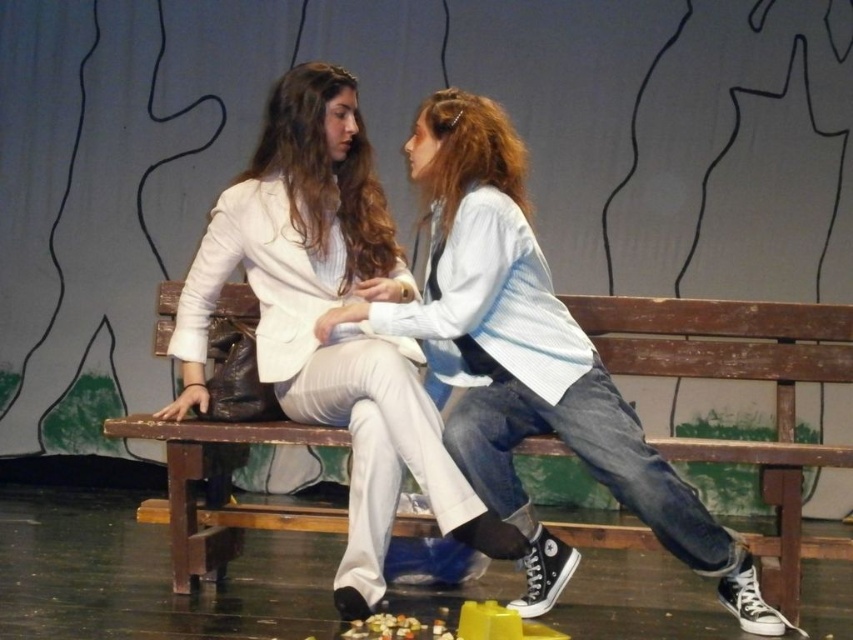
You are designing a stage set and need to ensure that the white matte blazer at center and the wooden bench at center fit within a 2 meter wide stage. Based on the description, can both objects fit side by side on the stage?

The white matte blazer at center might be wider than the wooden bench at center, so it is uncertain if both can fit side by side within the 2 meter width without overlapping. Further measurements are needed.

You are designing a theater set and need to ensure that the matte white blouse at center is visible over the wooden bench at center. Based on the scene description, will the blouse be visible from the audience seats?

The matte white blouse at center has a greater height compared to wooden bench at center, so yes, the blouse will be visible from the audience seats since it is taller than the bench.

You are a costume designer preparing for a play. You have two items in front of you on the stage set. The white matte blazer at center and the matte white blouse at center. Which one should you choose if you need a garment that covers more of the torso area?

The white matte blazer at center is larger in size than the matte white blouse at center, so you should choose the white matte blazer at center as it covers more of the torso area.